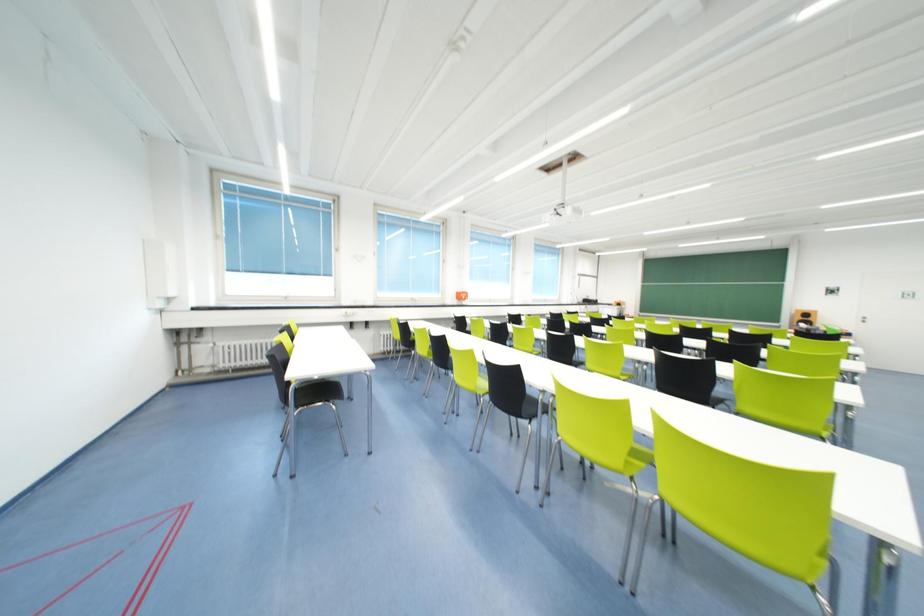
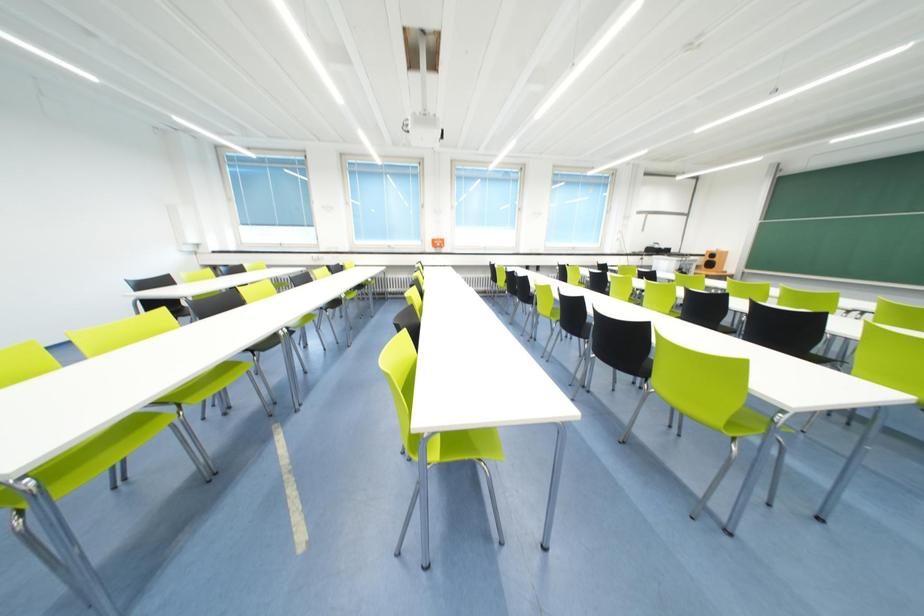
Question: Which direction would the cameraman need to move to produce the second image? Reply with the corresponding letter.

Choices:
 (A) Left
 (B) Right
 (C) Forward
 (D) Backward

Answer: (B)